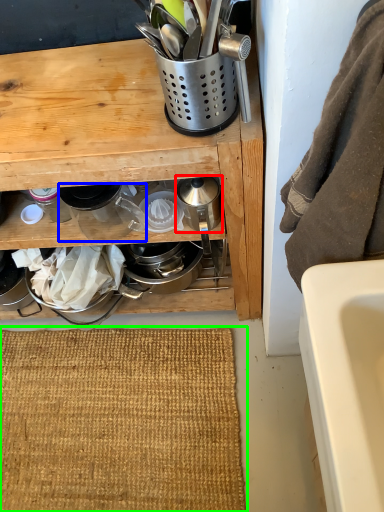
Question: Which object is the closest to the appliance (highlighted by a red box)? Choose among these: appliance (highlighted by a blue box) or doormat (highlighted by a green box).

Choices:
 (A) appliance
 (B) doormat

Answer: (A)